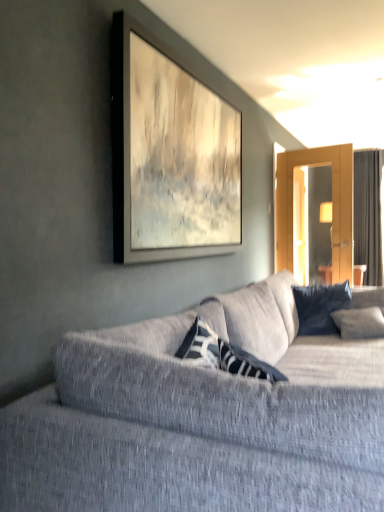
Question: Is dark gray fabric curtain at right facing away from textured gray couch at center?

Choices:
 (A) yes
 (B) no

Answer: (B)

Question: Is dark gray fabric curtain at right smaller than textured gray couch at center?

Choices:
 (A) no
 (B) yes

Answer: (B)

Question: Can you confirm if dark gray fabric curtain at right is wider than textured gray couch at center?

Choices:
 (A) yes
 (B) no

Answer: (B)

Question: Is dark gray fabric curtain at right outside of textured gray couch at center?

Choices:
 (A) yes
 (B) no

Answer: (A)

Question: Is dark gray fabric curtain at right behind textured gray couch at center?

Choices:
 (A) yes
 (B) no

Answer: (A)

Question: From the image's perspective, is textured gray couch at center positioned above or below dark blue textured pillow at center?

Choices:
 (A) above
 (B) below

Answer: (B)

Question: Considering the relative positions of textured gray couch at center and dark blue textured pillow at center in the image provided, is textured gray couch at center to the left or to the right of dark blue textured pillow at center?

Choices:
 (A) left
 (B) right

Answer: (A)

Question: In terms of size, does textured gray couch at center appear bigger or smaller than dark blue textured pillow at center?

Choices:
 (A) small
 (B) big

Answer: (B)

Question: Is point (200, 487) closer or farther from the camera than point (344, 292)?

Choices:
 (A) farther
 (B) closer

Answer: (B)

Question: From a real-world perspective, relative to textured gray couch at center, is dark gray fabric curtain at right vertically above or below?

Choices:
 (A) above
 (B) below

Answer: (A)

Question: Is dark gray fabric curtain at right inside the boundaries of textured gray couch at center, or outside?

Choices:
 (A) inside
 (B) outside

Answer: (B)

Question: Is dark gray fabric curtain at right bigger or smaller than textured gray couch at center?

Choices:
 (A) big
 (B) small

Answer: (B)

Question: Relative to textured gray couch at center, is dark gray fabric curtain at right in front or behind?

Choices:
 (A) front
 (B) behind

Answer: (B)

Question: In terms of height, does dark blue textured pillow at center look taller or shorter compared to textured gray couch at center?

Choices:
 (A) short
 (B) tall

Answer: (A)

Question: Considering the positions of point (319, 287) and point (94, 396), is point (319, 287) closer or farther from the camera than point (94, 396)?

Choices:
 (A) farther
 (B) closer

Answer: (A)